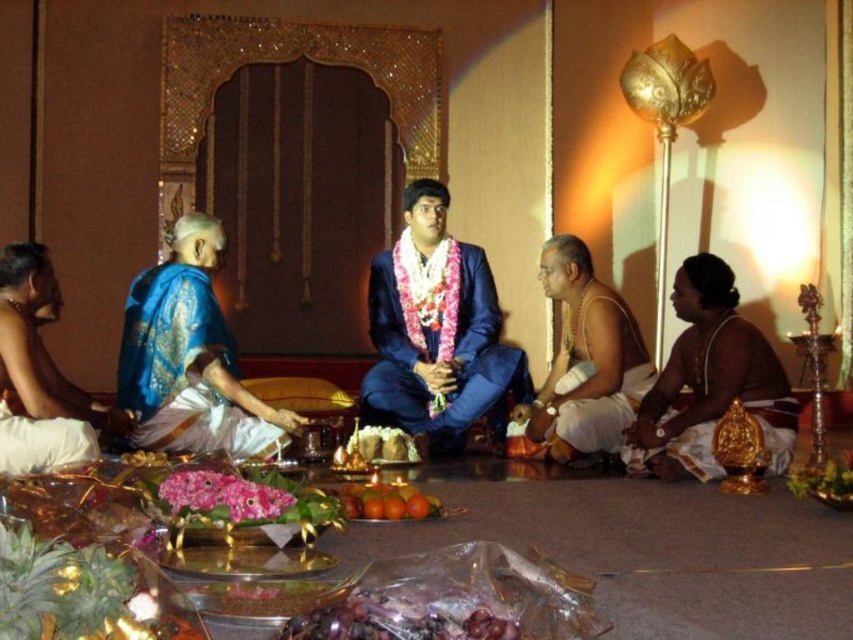
Question: Does blue satin suit at center lie behind blue silk saree at left?

Choices:
 (A) yes
 (B) no

Answer: (A)

Question: Is shiny plastic grapes at center in front of orange matte at center?

Choices:
 (A) yes
 (B) no

Answer: (A)

Question: Can you confirm if blue satin suit at center is positioned below shiny plastic grapes at center?

Choices:
 (A) no
 (B) yes

Answer: (A)

Question: Which object appears closest to the camera in this image?

Choices:
 (A) white silk dhoti at center
 (B) blue silk saree at left
 (C) brown silk dhoti at right

Answer: (C)

Question: Which object appears farthest from the camera in this image?

Choices:
 (A) brown silk dhoti at right
 (B) blue satin suit at center
 (C) shiny plastic grapes at center

Answer: (B)

Question: Which point is closer to the camera taking this photo?

Choices:
 (A) (419, 356)
 (B) (312, 621)
 (C) (579, 275)

Answer: (B)